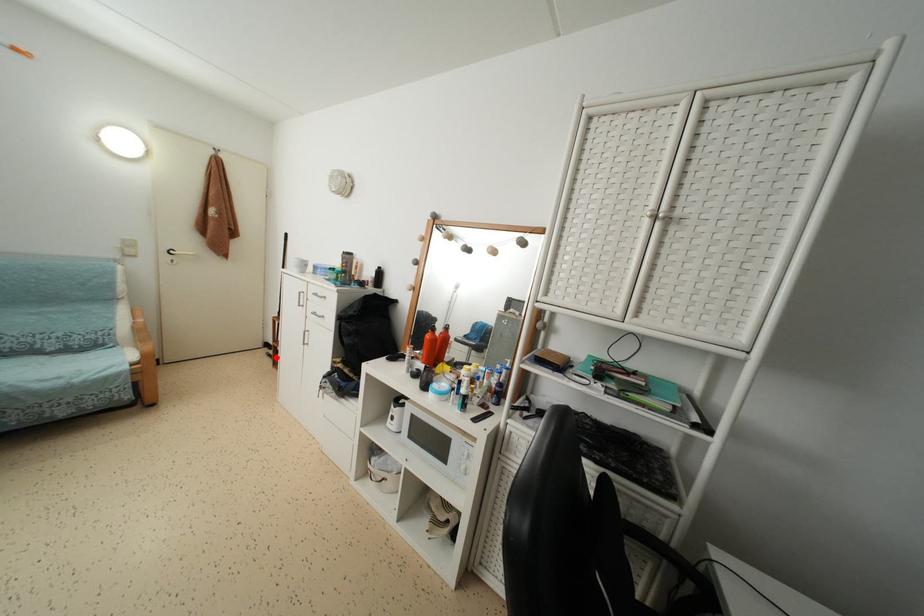
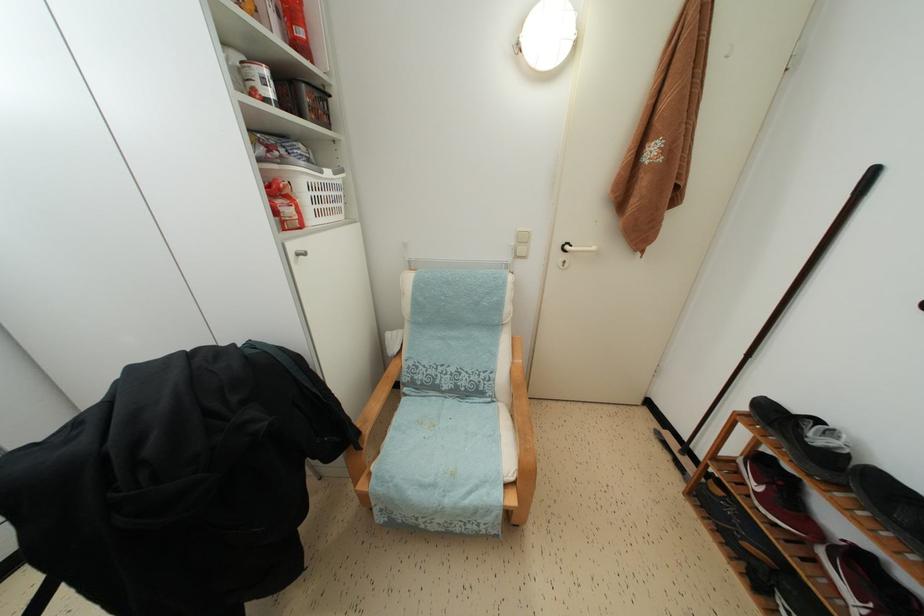
Locate, in the second image, the point that corresponds to the highlighted location in the first image.

(678, 450)